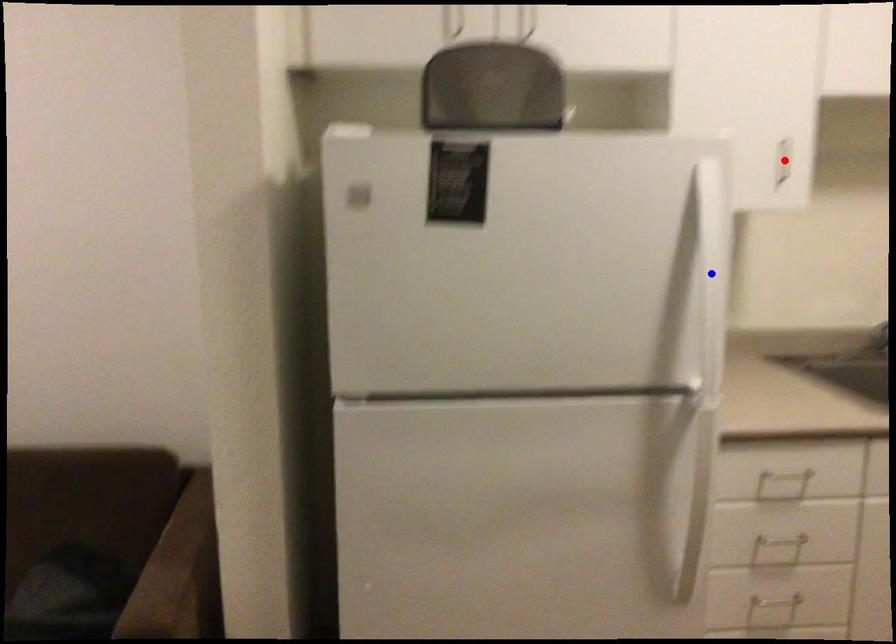
Question: In the image, two points are highlighted. Which point is nearer to the camera? Reply with the corresponding letter.

Choices:
 (A) blue point
 (B) red point

Answer: (A)